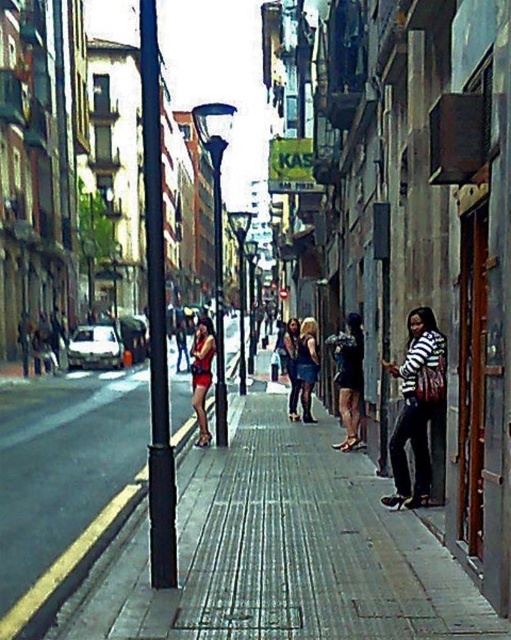
Question: Which of the following is the farthest from the observer?

Choices:
 (A) (303, 340)
 (B) (383, 580)
 (C) (200, 340)

Answer: (A)

Question: Does blue denim skirt at center have a lesser width compared to matte black dress at center?

Choices:
 (A) yes
 (B) no

Answer: (B)

Question: Among these points, which one is farthest from the camera?

Choices:
 (A) (152, 410)
 (B) (414, 392)

Answer: (B)

Question: Is concrete sidewalk at center to the left of matte red dress at center from the viewer's perspective?

Choices:
 (A) no
 (B) yes

Answer: (A)

Question: Can you confirm if concrete sidewalk at center is wider than matte black dress at center?

Choices:
 (A) yes
 (B) no

Answer: (A)

Question: Which object is closer to the camera taking this photo?

Choices:
 (A) matte black dress at center
 (B) blue denim skirt at center
 (C) concrete sidewalk at center

Answer: (C)